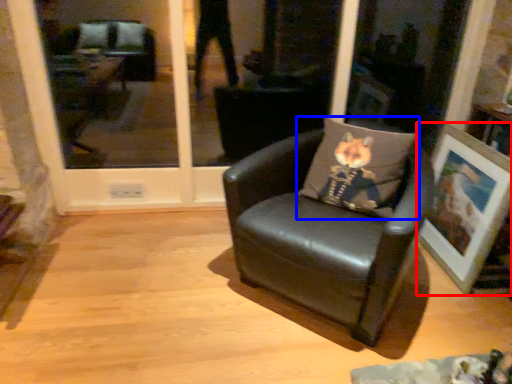
Question: Which point is closer to the camera, picture frame (highlighted by a red box) or pillow (highlighted by a blue box)?

Choices:
 (A) picture frame
 (B) pillow

Answer: (B)